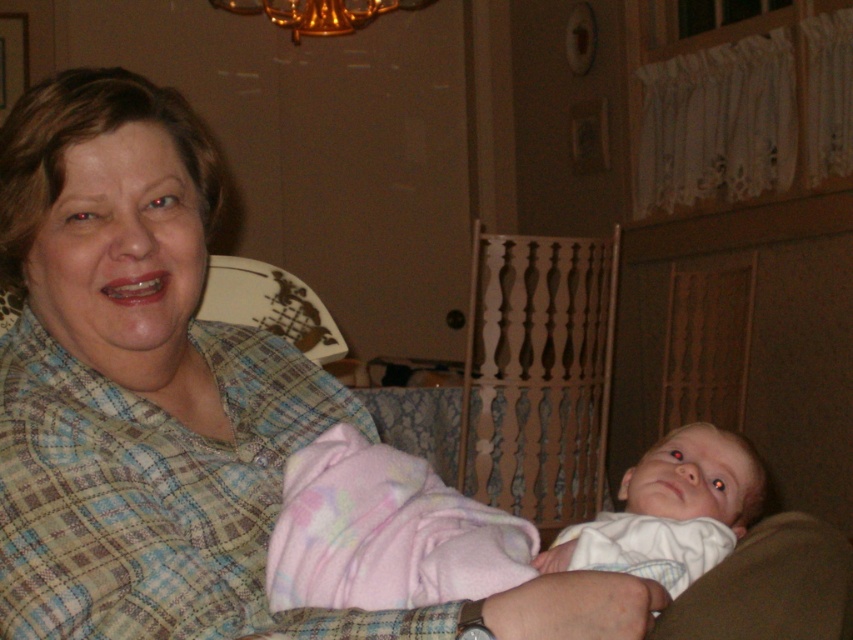
You are a photographer adjusting the focus on your camera. You want to capture the plaid fabric at center and the white cotton baby at center. Which object should you focus on first if you want to ensure both are in focus?

The plaid fabric at center is closer to the viewer than the white cotton baby at center, so you should focus on the plaid fabric at center first to ensure both are in focus.

You are a photographer trying to capture the plaid fabric at center in the image. The camera is set to focus on the point at coordinates point (170, 403). Is this the correct point to focus on to ensure the plaid fabric at center is in focus?

Yes, the point (170, 403) corresponds to the plaid fabric at center, so focusing there will ensure it is in focus.